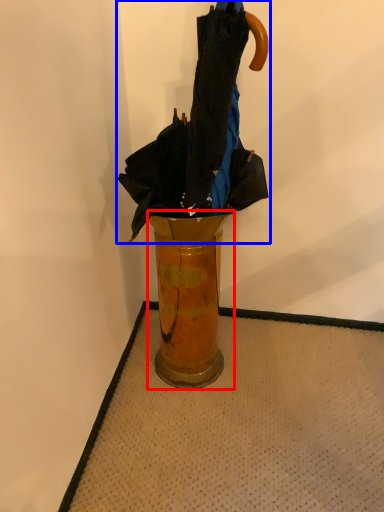
Question: Which object appears farthest to the camera in this image, vase (highlighted by a red box) or umbrella (highlighted by a blue box)?

Choices:
 (A) vase
 (B) umbrella

Answer: (A)